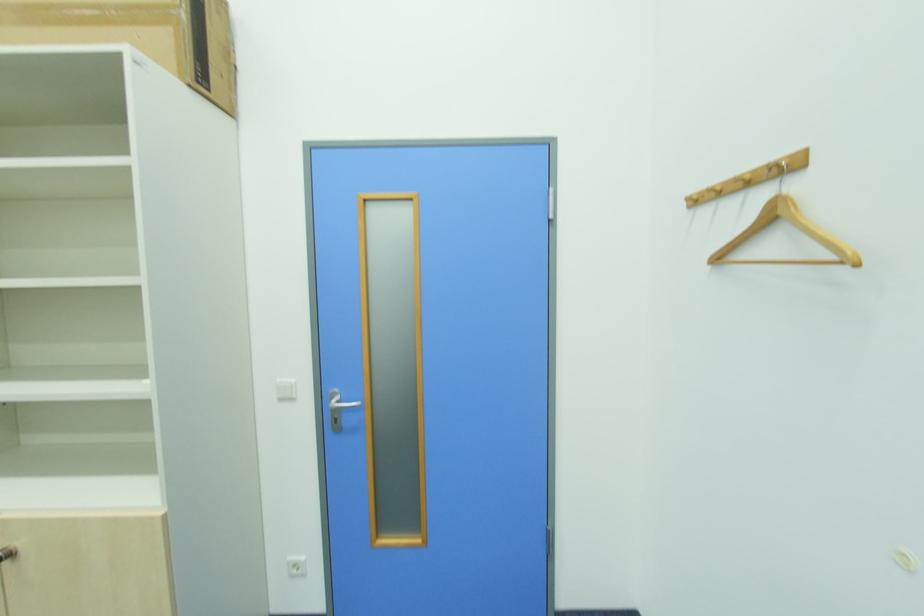
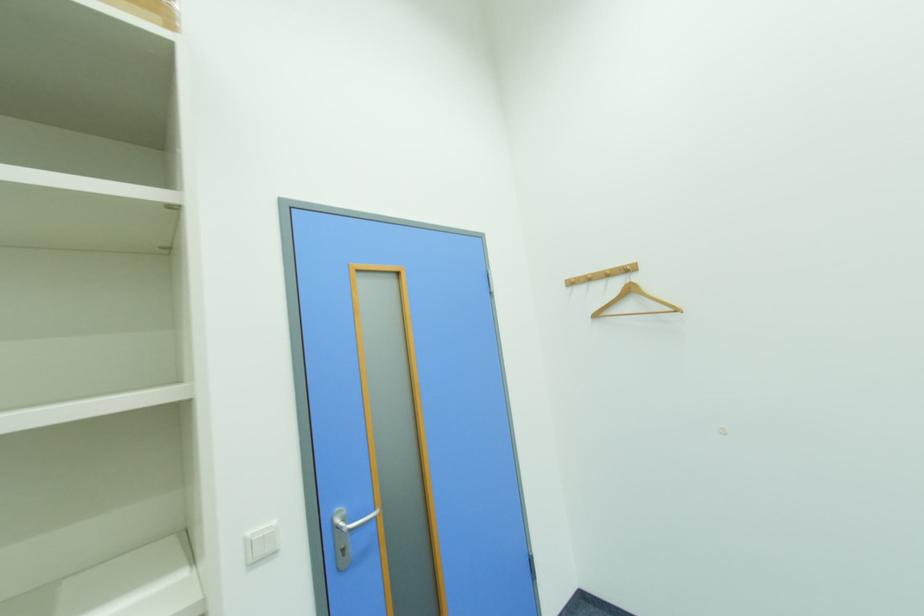
Locate, in the second image, the point that corresponds to the point at 794,159 in the first image.

(634, 267)